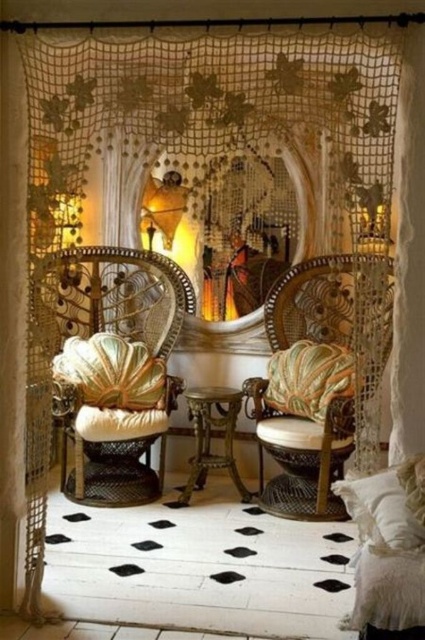
Question: Which object is the closest to the patterned fabric pillow at center?

Choices:
 (A) matte wicker armchair at center
 (B) velvet gold armchair at left

Answer: (A)

Question: Among these points, which one is farthest from the camera?

Choices:
 (A) (311, 352)
 (B) (294, 451)
 (C) (135, 484)

Answer: (C)

Question: Which point appears farthest from the camera in this image?

Choices:
 (A) (387, 525)
 (B) (133, 413)
 (C) (328, 397)
 (D) (269, 420)

Answer: (D)

Question: Is velvet gold armchair at left bigger than white fluffy pillow at lower right?

Choices:
 (A) no
 (B) yes

Answer: (B)

Question: Observing the image, what is the correct spatial positioning of matte wicker armchair at center in reference to patterned fabric pillow at center?

Choices:
 (A) below
 (B) above

Answer: (B)

Question: Can you confirm if velvet gold armchair at left is positioned to the left of matte wicker armchair at center?

Choices:
 (A) no
 (B) yes

Answer: (B)